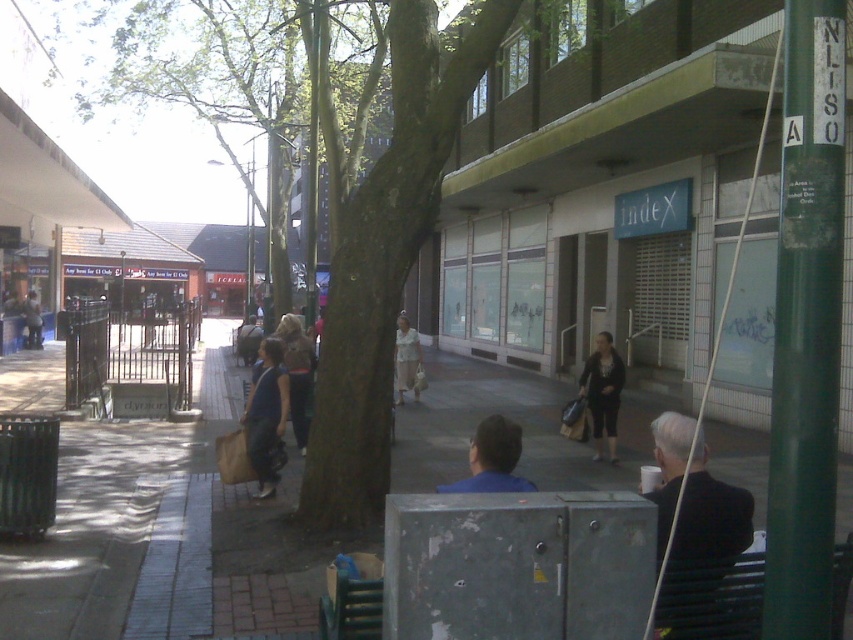
You are standing on the sidewalk looking at the street scene. You see a black fabric jacket at lower right and a matte blue shirt at center. Which item is nearer to you?

The black fabric jacket at lower right is closer to the viewer than the matte blue shirt at center.

You are standing on the sidewalk in the commercial area and want to sit down. You see the metallic dark green bench at lower right. Is the bench positioned under the shade of the trees?

The metallic dark green bench at lower right is located at point [712,600], which is not under the shade of the trees since the trees are on the sidewalk and the bench is near the building with light beige facade. Therefore, the bench is likely in direct sunlight.